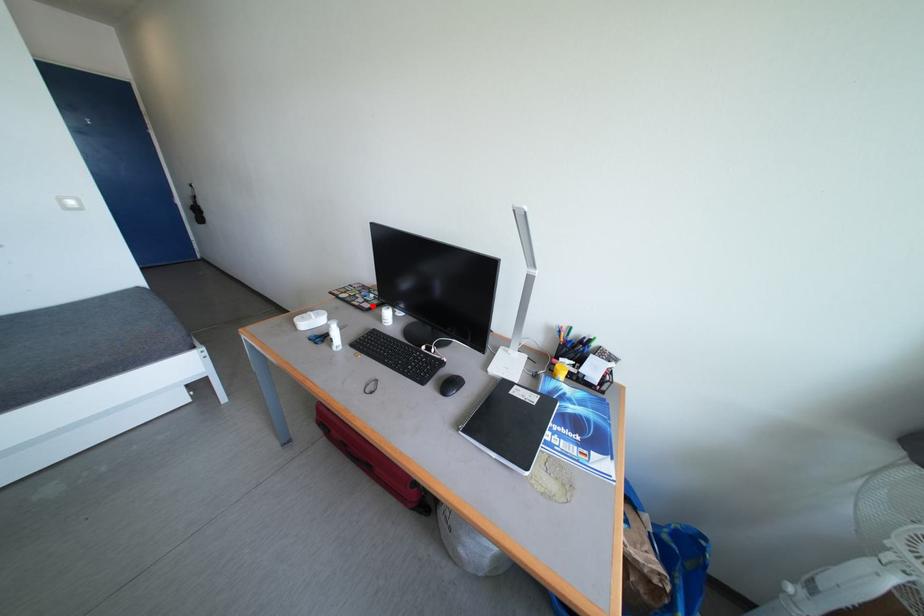
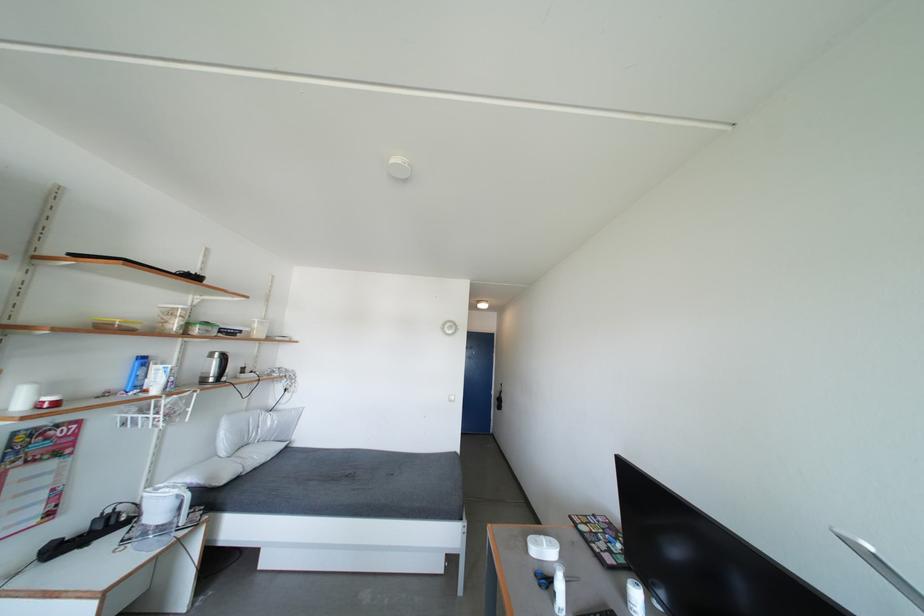
In the second image, find the point that corresponds to the highlighted location in the first image.

(616, 556)